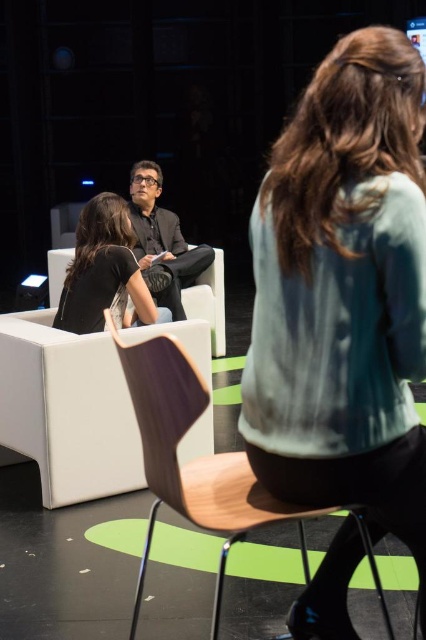
You are standing at the origin point of the coordinate system in this scene. You need to walk to the wooden chair at center. Which direction should you head towards?

The wooden chair at center is located at coordinate point (203, 465), so you should head towards the northeast direction from your current position at the origin.